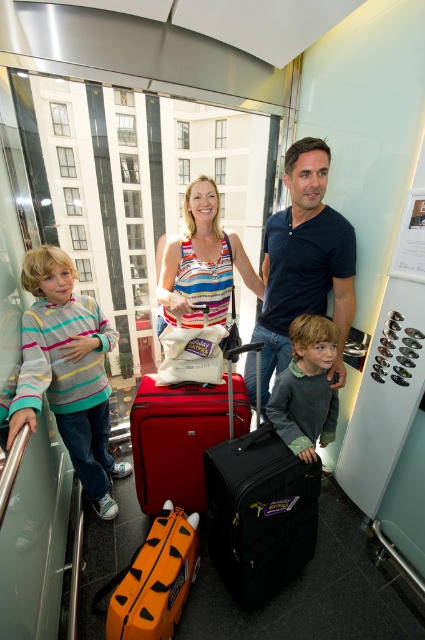
Question: Estimate the real-world distances between objects in this image. Which object is closer to the striped cotton shirt at left?

Choices:
 (A) matte black suitcase at center
 (B) striped fabric tank top at center
 (C) matte red suitcase at center
 (D) black matte suitcase at center

Answer: (C)

Question: Is matte red suitcase at center below gray fleece sweater at center?

Choices:
 (A) yes
 (B) no

Answer: (A)

Question: Can you confirm if striped fabric tank top at center is positioned above gray fleece sweater at center?

Choices:
 (A) no
 (B) yes

Answer: (B)

Question: Based on their relative distances, which object is farther from the dark blue t-shirt at center?

Choices:
 (A) gray fleece sweater at center
 (B) matte red suitcase at center

Answer: (B)

Question: Is matte black suitcase at center wider than dark blue t-shirt at center?

Choices:
 (A) no
 (B) yes

Answer: (B)

Question: Which of the following is the farthest from the observer?

Choices:
 (A) striped cotton shirt at left
 (B) matte black suitcase at center

Answer: (B)